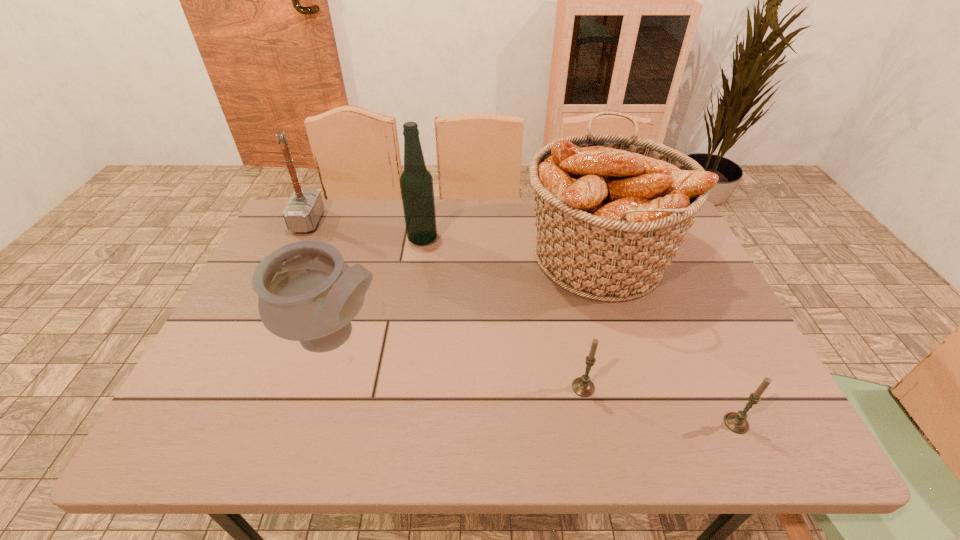
Identify the location of vacant space positioned 0.270m on the striking surface of the leftmost object. (408, 221).

Locate an element on the screen. vacant area situated on the back of the pottery is located at coordinates (366, 233).

The height and width of the screenshot is (540, 960). Identify the location of vacant area situated 0.320m on the right of the farther candle. (747, 387).

At what (x,y) coordinates should I click in order to perform the action: click on vacant area located 0.070m on the back of the right candle. Please return your answer as a coordinate pair (x, y). The height and width of the screenshot is (540, 960). Looking at the image, I should click on (718, 383).

At what (x,y) coordinates should I click in order to perform the action: click on alcohol that is at the far edge. Please return your answer as a coordinate pair (x, y). Image resolution: width=960 pixels, height=540 pixels. Looking at the image, I should click on (416, 183).

In order to click on basket that is at the far edge in this screenshot , I will do `click(612, 210)`.

Locate an element on the screen. Image resolution: width=960 pixels, height=540 pixels. hammer positioned at the far edge is located at coordinates (305, 207).

The width and height of the screenshot is (960, 540). I want to click on object situated at the near edge, so click(736, 422).

At what (x,y) coordinates should I click in order to perform the action: click on hammer that is at the left edge. Please return your answer as a coordinate pair (x, y). Looking at the image, I should click on (305, 207).

Image resolution: width=960 pixels, height=540 pixels. Find the location of `pottery that is at the left edge`. pottery that is at the left edge is located at coordinates (307, 293).